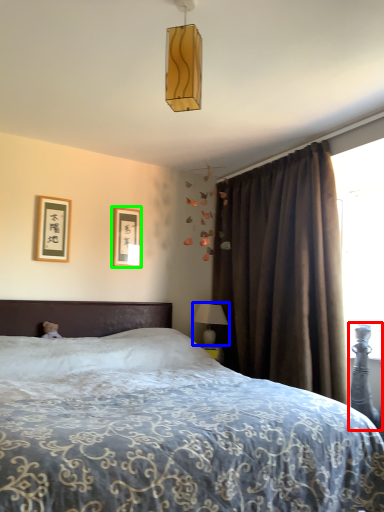
Question: Which object is the closest to the swivel chair (highlighted by a red box)? Choose among these: table lamp (highlighted by a blue box) or picture frame (highlighted by a green box).

Choices:
 (A) table lamp
 (B) picture frame

Answer: (A)